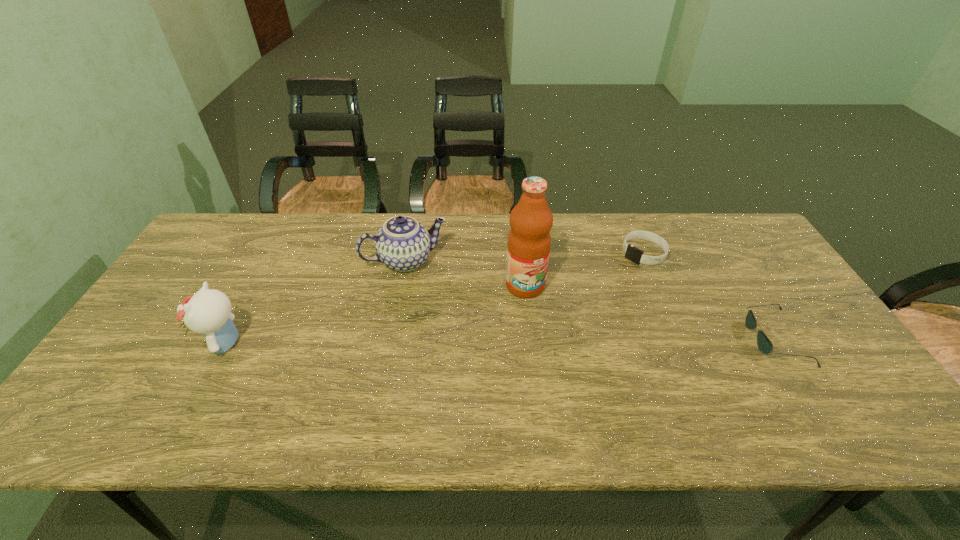
This screenshot has width=960, height=540. Find the location of `vacant region located 0.260m on the lenses of the sunglasses`. vacant region located 0.260m on the lenses of the sunglasses is located at coordinates (650, 338).

The width and height of the screenshot is (960, 540). What are the coordinates of `free space located 0.370m on the lenses of the sunglasses` in the screenshot? It's located at (608, 338).

The width and height of the screenshot is (960, 540). Find the location of `vacant area situated on the outer surface of the second object from right to left`. vacant area situated on the outer surface of the second object from right to left is located at coordinates (562, 312).

Where is `vacant space located on the outer surface of the second object from right to left`? vacant space located on the outer surface of the second object from right to left is located at coordinates (583, 296).

Identify the location of free space located on the outer surface of the second object from right to left. Image resolution: width=960 pixels, height=540 pixels. (576, 302).

Locate an element on the screen. vacant region located at the spout of the second object from left to right is located at coordinates (433, 318).

The width and height of the screenshot is (960, 540). I want to click on free space located 0.060m at the spout of the second object from left to right, so click(x=423, y=291).

This screenshot has height=540, width=960. Find the location of `free space located 0.100m at the spout of the second object from left to right`. free space located 0.100m at the spout of the second object from left to right is located at coordinates (426, 300).

What are the coordinates of `free location located 0.150m on the front label of the fruit juice` in the screenshot? It's located at (554, 339).

The height and width of the screenshot is (540, 960). I want to click on vacant space situated 0.160m on the front label of the fruit juice, so click(x=556, y=342).